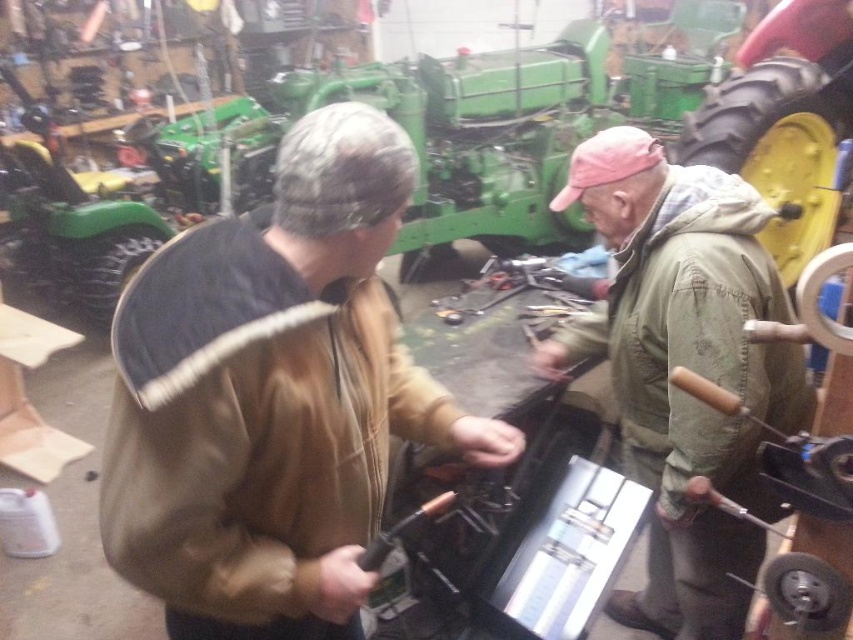
You are a mechanic in the workshop. You need to hand the metallic black screwdriver at center to the person wearing the green canvas jacket at center. Can you reach it without moving the screwdriver?

The green canvas jacket at center is located above the metallic black screwdriver at center, so the person wearing the green canvas jacket at center can easily reach down to pick up the screwdriver without moving it.